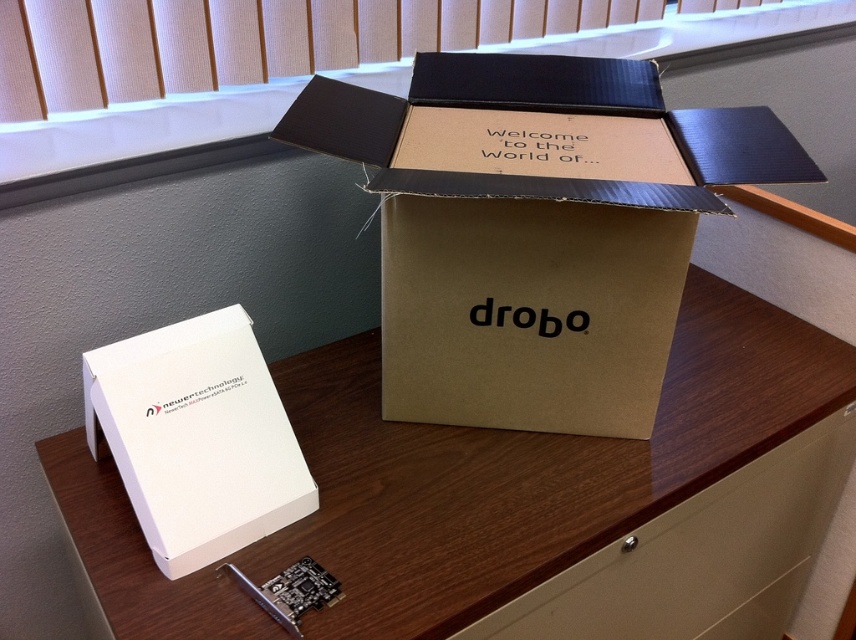
Question: Can you confirm if white cardboard box at center is positioned below brown cardboard box at center?

Choices:
 (A) no
 (B) yes

Answer: (B)

Question: Does white cardboard box at center appear on the right side of brown cardboard box at center?

Choices:
 (A) yes
 (B) no

Answer: (B)

Question: Which of the following is the closest to the observer?

Choices:
 (A) white matte/newer technology box at lower left
 (B) white cardboard box at center

Answer: (B)

Question: Estimate the real-world distances between objects in this image. Which object is closer to the white cardboard box at center?

Choices:
 (A) wooden at center
 (B) white matte/newer technology box at lower left

Answer: (A)

Question: Can you confirm if wooden at center is bigger than white matte/newer technology box at lower left?

Choices:
 (A) yes
 (B) no

Answer: (A)

Question: Estimate the real-world distances between objects in this image. Which object is farther from the wooden at center?

Choices:
 (A) white cardboard box at center
 (B) white matte/newer technology box at lower left
 (C) brown cardboard box at center

Answer: (B)